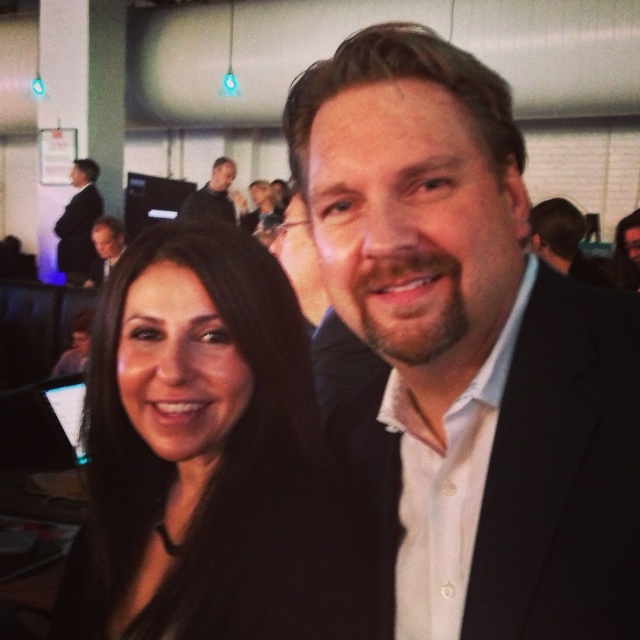
Is dark suit at left shorter than matte black suit at center?

No.

Is dark suit at left taller than matte black suit at center?

Indeed, dark suit at left has a greater height compared to matte black suit at center.

What do you see at coordinates (77, 224) in the screenshot? I see `dark suit at left` at bounding box center [77, 224].

Identify the location of dark suit at left. (77, 224).

Does dark suit at left have a smaller size compared to matte black suit at upper left?

Correct, dark suit at left occupies less space than matte black suit at upper left.

Is dark suit at left further to the viewer compared to matte black suit at upper left?

Yes, dark suit at left is further from the viewer.

At what (x,y) coordinates should I click in order to perform the action: click on dark suit at left. Please return your answer as a coordinate pair (x, y). The image size is (640, 640). Looking at the image, I should click on (77, 224).

Between point (209, 193) and point (96, 260), which one is positioned in front?

Point (96, 260) is in front.

Does dark gray suit at upper center appear under matte black suit at upper left?

Incorrect, dark gray suit at upper center is not positioned below matte black suit at upper left.

The height and width of the screenshot is (640, 640). I want to click on dark gray suit at upper center, so click(212, 195).